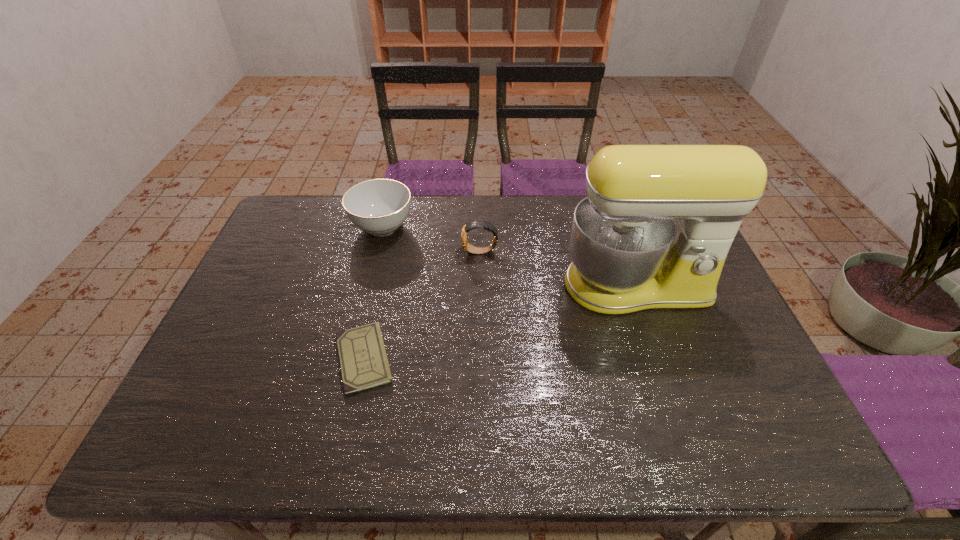
Locate an element on the screen. This screenshot has height=540, width=960. vacant space in between the shortest object and the mixer is located at coordinates (499, 322).

Where is `free space between the checkbook and the chinaware`? Image resolution: width=960 pixels, height=540 pixels. free space between the checkbook and the chinaware is located at coordinates (373, 293).

Where is `free point between the chinaware and the nearest object`? The width and height of the screenshot is (960, 540). free point between the chinaware and the nearest object is located at coordinates (373, 293).

Locate an element on the screen. The image size is (960, 540). vacant area between the rightmost object and the third object from left to right is located at coordinates (558, 269).

Locate an element on the screen. free area in between the checkbook and the chinaware is located at coordinates (373, 293).

At what (x,y) coordinates should I click in order to perform the action: click on blank region between the shortest object and the chinaware. Please return your answer as a coordinate pair (x, y). The width and height of the screenshot is (960, 540). Looking at the image, I should click on (373, 293).

You are a GUI agent. You are given a task and a screenshot of the screen. Output one action in this format:
    pyautogui.click(x=<x>, y=<y>)
    Task: Click on the vacant area that lies between the shortest object and the watch
    This screenshot has height=540, width=960.
    Given the screenshot: What is the action you would take?
    pyautogui.click(x=422, y=305)

Locate an element on the screen. The width and height of the screenshot is (960, 540). object that is the closest to the nearest object is located at coordinates (469, 248).

Locate which object is the second closest to the mixer. Please provide its 2D coordinates. Your answer should be formatted as a tuple, i.e. [(x, y)], where the tuple contains the x and y coordinates of a point satisfying the conditions above.

[(364, 364)]

You are a GUI agent. You are given a task and a screenshot of the screen. Output one action in this format:
    pyautogui.click(x=<x>, y=<y>)
    Task: Click on the vacant space that satisfies the following two spatial constraints: 1. on the front side of the checkbook; 2. on the right side of the chinaware
    The width and height of the screenshot is (960, 540).
    Given the screenshot: What is the action you would take?
    tap(349, 358)